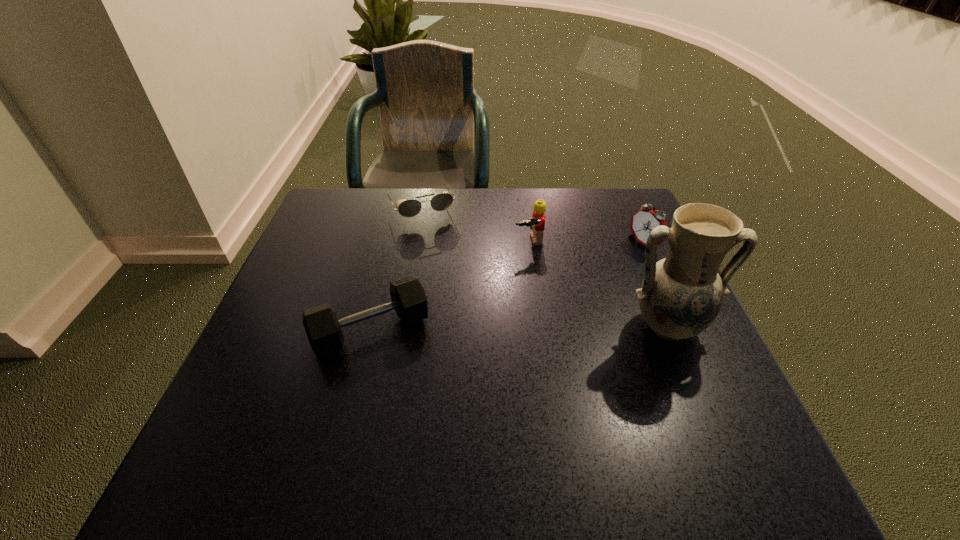
Find the location of a particular element. The width and height of the screenshot is (960, 540). vacant spot on the desktop that is between the fourth tallest object and the pottery and is positioned on the clock face of the alarm clock is located at coordinates (483, 329).

Where is `vacant space on the desktop that is between the dumbbell and the pottery and is positioned on the front lenses of the shortest object`? vacant space on the desktop that is between the dumbbell and the pottery and is positioned on the front lenses of the shortest object is located at coordinates (483, 329).

The height and width of the screenshot is (540, 960). Find the location of `vacant space on the desktop that is between the dumbbell and the tallest object and is positioned in front of the third object from left to right with the accessory visible`. vacant space on the desktop that is between the dumbbell and the tallest object and is positioned in front of the third object from left to right with the accessory visible is located at coordinates (563, 328).